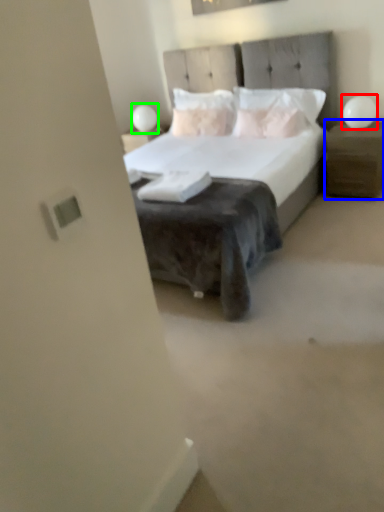
Question: Estimate the real-world distances between objects in this image. Which object is farther from table lamp (highlighted by a red box), nightstand (highlighted by a blue box) or table lamp (highlighted by a green box)?

Choices:
 (A) nightstand
 (B) table lamp

Answer: (B)